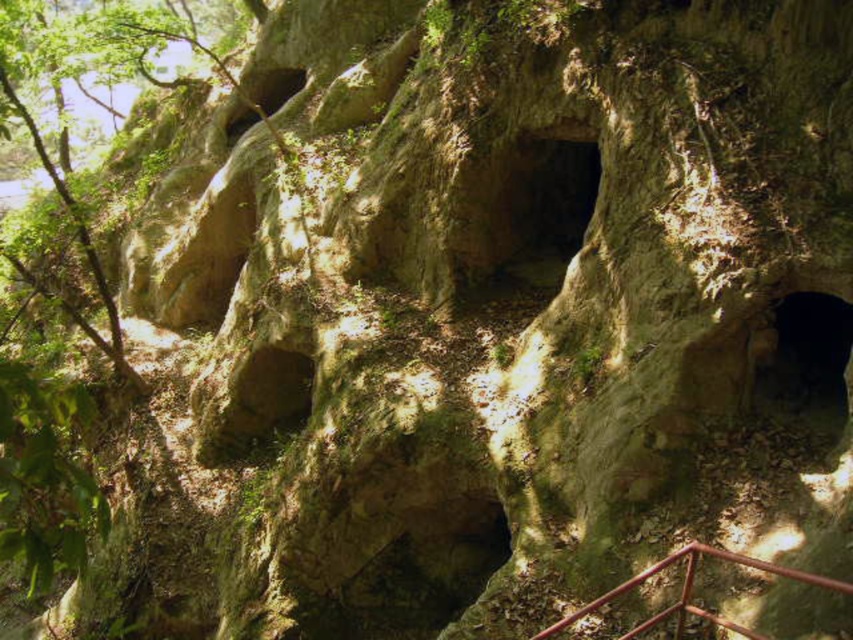
From the picture: You are a hiker standing at the base of the rock formation. You notice two points marked on the rock face. One is at coordinates point (759, 356) and the other at point (567, 624). Which point is closer to you?

Point (567, 624) is closer to you because it is in front of point (759, 356).

You are a hiker trying to navigate through the rock formation. You notice the dark brown stone cave at lower right and the red metal railing at lower right. Which of these two objects is narrower?

The dark brown stone cave at lower right is thinner than the red metal railing at lower right, so the dark brown stone cave at lower right is narrower.

You are a hiker standing at the base of the rock formation and want to reach the dark brown stone cave at lower right. There is a red metal railing at lower right nearby. Which object is closer to you as you approach the cave?

The dark brown stone cave at lower right is closer to you than the red metal railing at lower right, so you will reach the cave before the railing.